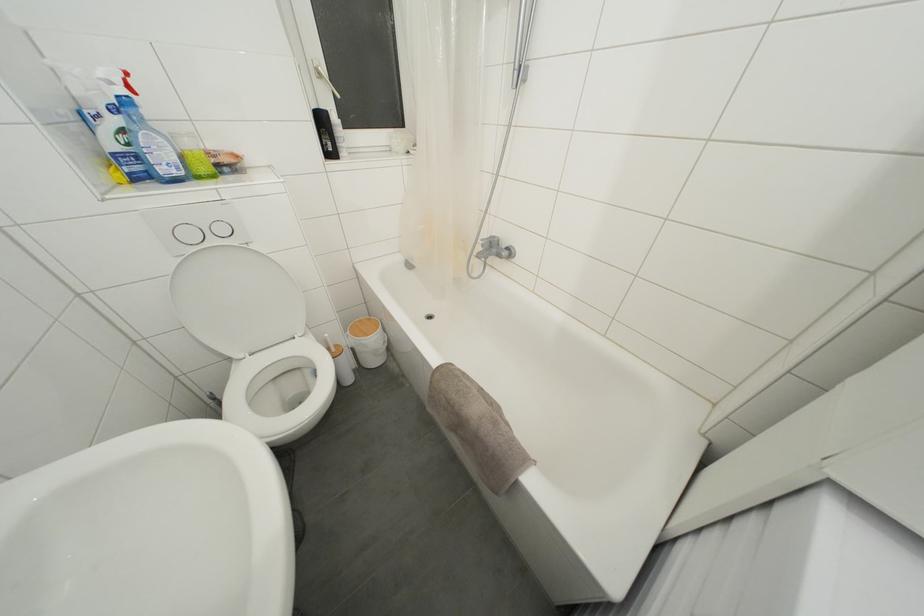
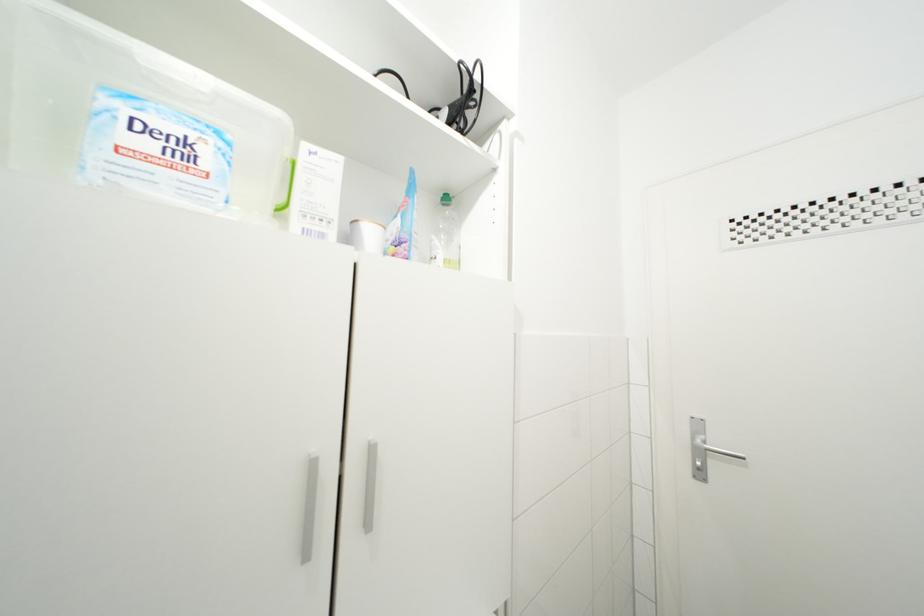
Question: The camera is either moving clockwise (left) or counter-clockwise (right) around the object. The first image is from the beginning of the video and the second image is from the end. Is the camera moving left or right when shooting the video?

Choices:
 (A) Left
 (B) Right

Answer: (A)